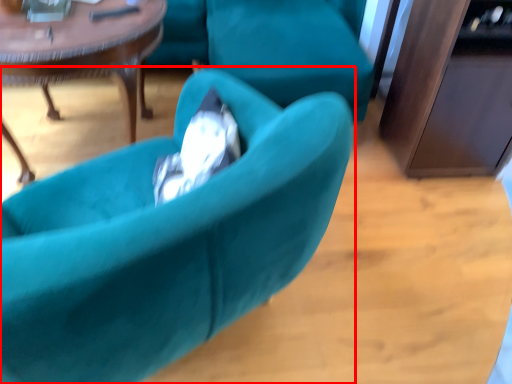
Question: Where is chair (annotated by the red box) located in relation to coffee table in the image?

Choices:
 (A) left
 (B) right

Answer: (B)